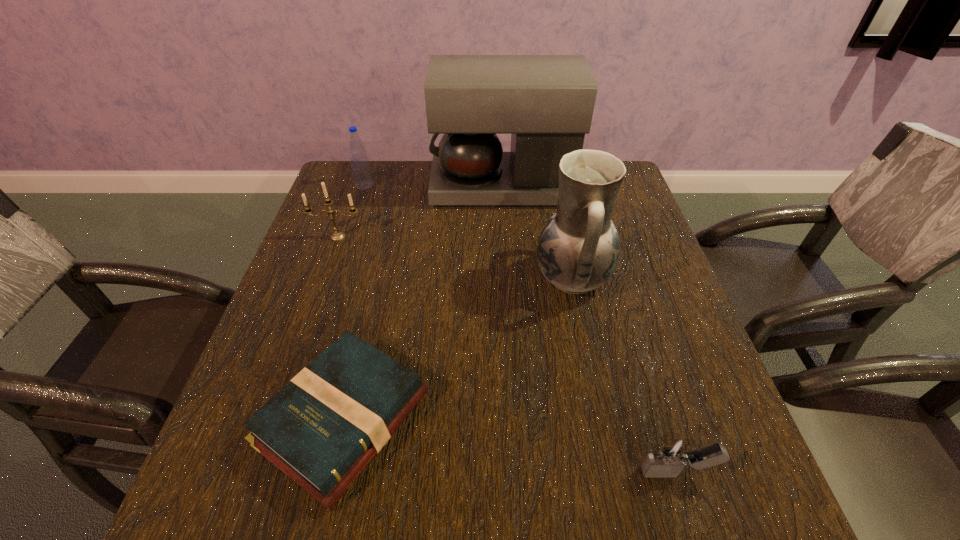
Identify the location of vacant space at the left edge of the desktop. Image resolution: width=960 pixels, height=540 pixels. (223, 448).

Identify the location of free space at the right edge of the desktop. The height and width of the screenshot is (540, 960). (663, 343).

This screenshot has height=540, width=960. I want to click on vacant space at the far left corner of the desktop, so click(379, 201).

Image resolution: width=960 pixels, height=540 pixels. Find the location of `free space at the near right corner`. free space at the near right corner is located at coordinates (743, 478).

The width and height of the screenshot is (960, 540). I want to click on free space between the water bottle and the fifth tallest object, so click(x=520, y=329).

Find the location of `free space between the coffee maker and the shortest object`. free space between the coffee maker and the shortest object is located at coordinates (423, 302).

Where is `free spot between the candle and the third nearest object`? The image size is (960, 540). free spot between the candle and the third nearest object is located at coordinates (455, 257).

Image resolution: width=960 pixels, height=540 pixels. Identify the location of empty location between the igniter and the water bottle. (520, 329).

At what (x,y) coordinates should I click in order to perform the action: click on free area in between the water bottle and the second shortest object. Please return your answer as a coordinate pair (x, y). Looking at the image, I should click on point(520,329).

The height and width of the screenshot is (540, 960). Identify the location of free space between the water bottle and the fifth tallest object. (520, 329).